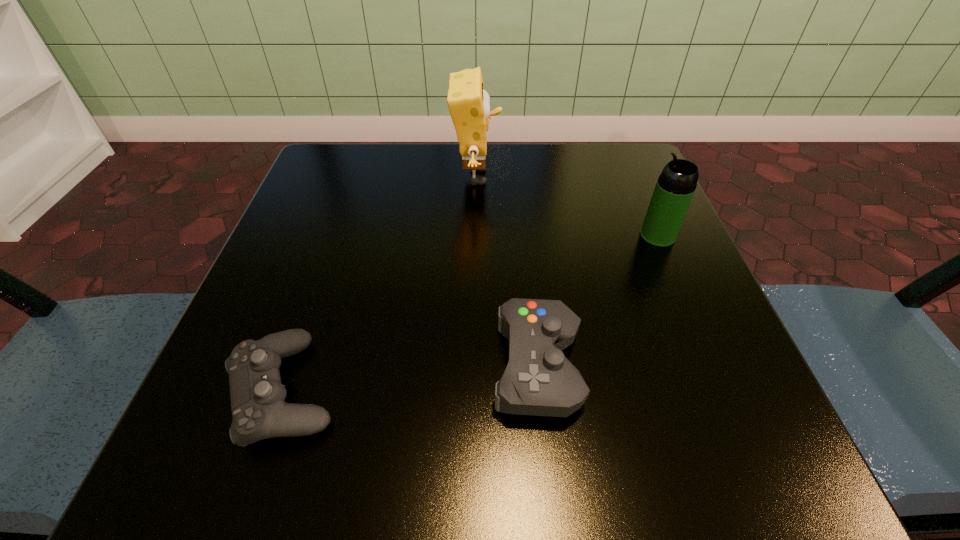
At what (x,y) coordinates should I click in order to perform the action: click on the tallest object. Please return your answer as a coordinate pair (x, y). Looking at the image, I should click on (469, 104).

Find the location of `sponge`. sponge is located at coordinates (469, 104).

The image size is (960, 540). I want to click on the third nearest object, so click(x=676, y=185).

Locate an element on the screen. This screenshot has width=960, height=540. the rightmost object is located at coordinates click(676, 185).

Identify the location of the right control. The height and width of the screenshot is (540, 960). (539, 380).

Identify the location of the left control. coord(259,410).

Locate an element on the screen. Image resolution: width=960 pixels, height=540 pixels. free point located on the face of the sponge is located at coordinates (565, 177).

This screenshot has height=540, width=960. In order to click on vacant area situated from the spout of the rightmost object in this screenshot , I will do `click(564, 235)`.

Locate an element on the screen. The width and height of the screenshot is (960, 540). vacant space located 0.400m from the spout of the rightmost object is located at coordinates 423,235.

I want to click on vacant space located from the spout of the rightmost object, so point(548,235).